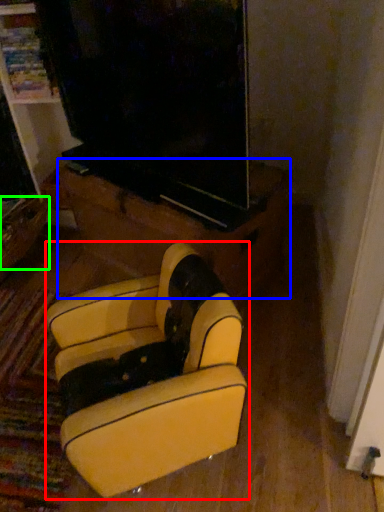
Question: Which object is positioned closest to furniture (highlighted by a red box)? Select from furniture (highlighted by a blue box) and drawer (highlighted by a green box).

Choices:
 (A) furniture
 (B) drawer

Answer: (A)